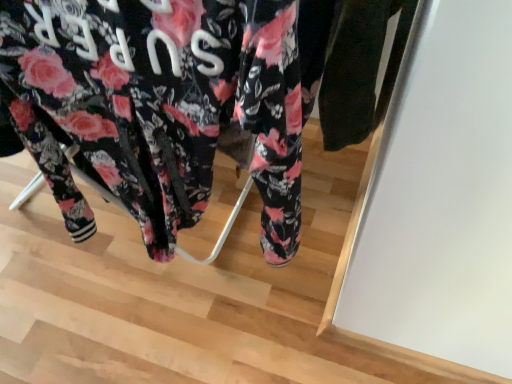
Locate an element on the screen. This screenshot has height=384, width=512. vacant region under floral fabric pants at center (from a real-world perspective) is located at coordinates (152, 274).